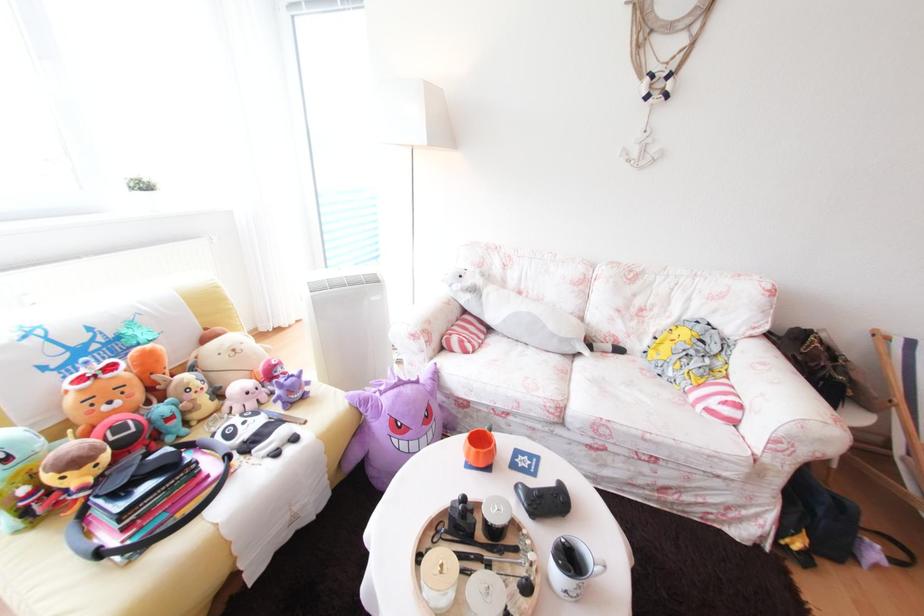
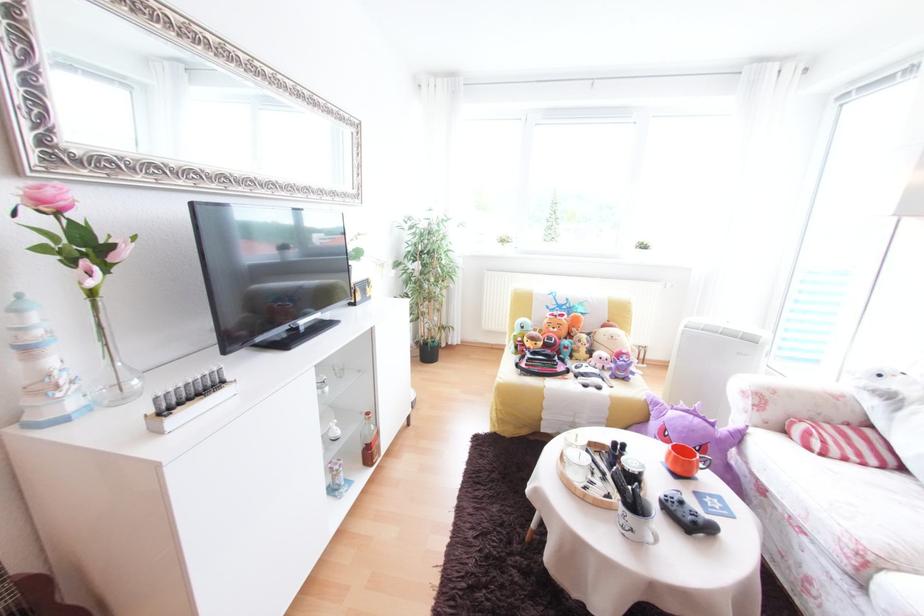
In the second image, find the point that corresponds to [497,334] in the first image.

(907, 472)